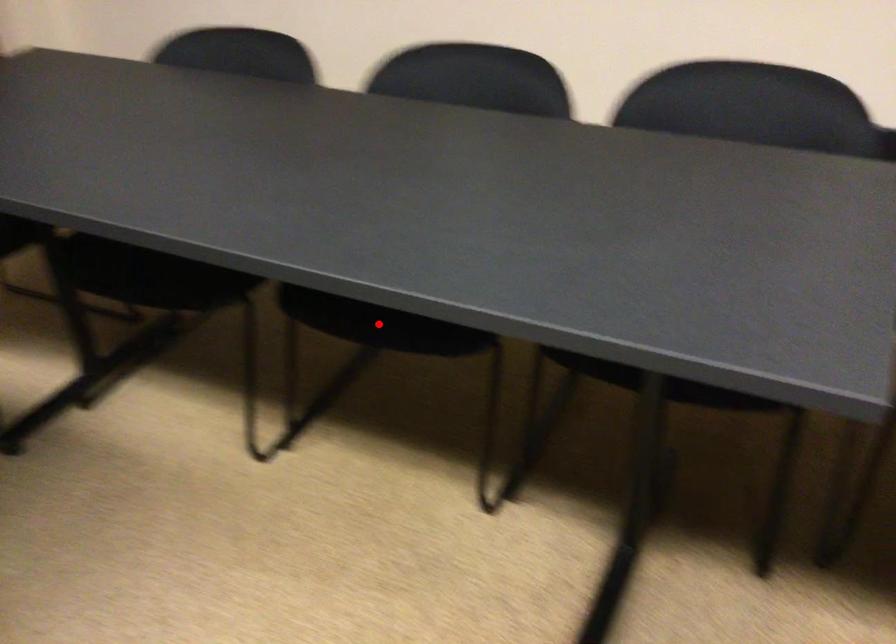
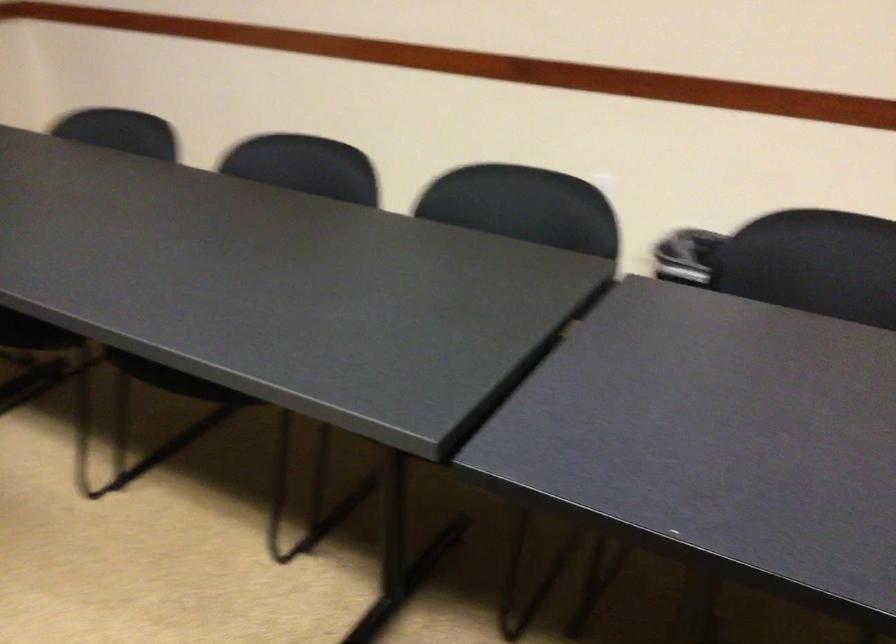
Question: I am providing you with two images of the same scene from different viewpoints. A red point is marked on the first image. Can you still see the location of the red point in image 2?

Choices:
 (A) Yes
 (B) No

Answer: (B)